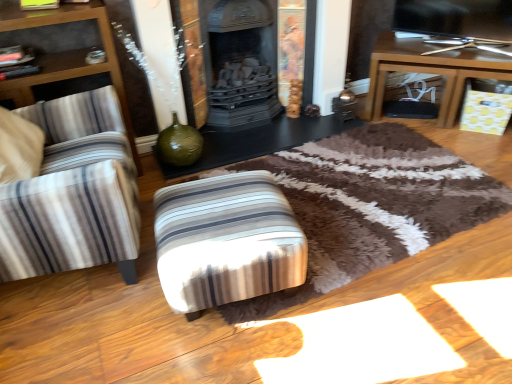
You are a GUI agent. You are given a task and a screenshot of the screen. Output one action in this format:
    pyautogui.click(x=<x>, y=<y>)
    Task: Click on the vacant space to the right of black glossy table at center, which ranks as the first table in left-to-right order
    The width and height of the screenshot is (512, 384).
    Given the screenshot: What is the action you would take?
    click(x=389, y=160)